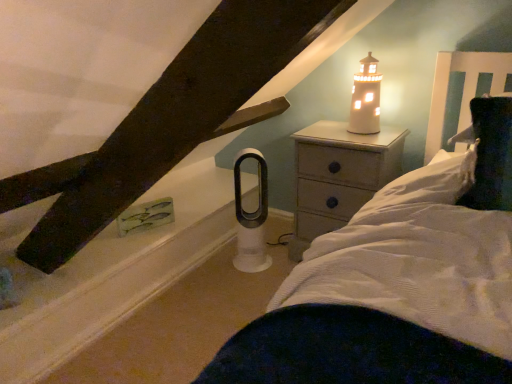
Locate an element on the screen. wooden nightstand at upper right is located at coordinates (339, 176).

Are white matte window sill at lower left and white ceramic lighthouse at upper right beside each other?

white matte window sill at lower left is not next to white ceramic lighthouse at upper right, and they're not touching.

From the image's perspective, is white matte window sill at lower left positioned above or below white ceramic lighthouse at upper right?

Clearly, from the image's perspective, white matte window sill at lower left is below white ceramic lighthouse at upper right.

Is white matte window sill at lower left facing towards white ceramic lighthouse at upper right?

No, white matte window sill at lower left is not facing towards white ceramic lighthouse at upper right.

The width and height of the screenshot is (512, 384). Find the location of `nightstand located below the white ceramic lighthouse at upper right (from the image's perspective)`. nightstand located below the white ceramic lighthouse at upper right (from the image's perspective) is located at coordinates (339, 176).

Is white ceramic lighthouse at upper right inside or outside of wooden nightstand at upper right?

white ceramic lighthouse at upper right lies outside wooden nightstand at upper right.

Considering the relative sizes of white ceramic lighthouse at upper right and wooden nightstand at upper right in the image provided, is white ceramic lighthouse at upper right taller than wooden nightstand at upper right?

In fact, white ceramic lighthouse at upper right may be shorter than wooden nightstand at upper right.

From the image's perspective, is white ceramic lighthouse at upper right positioned above or below wooden nightstand at upper right?

white ceramic lighthouse at upper right is above wooden nightstand at upper right.

Consider the image. From a real-world perspective, who is located higher, wooden nightstand at upper right or white ceramic lighthouse at upper right?

white ceramic lighthouse at upper right.

Is wooden nightstand at upper right turned away from white ceramic lighthouse at upper right?

wooden nightstand at upper right is not turned away from white ceramic lighthouse at upper right.

How different are the orientations of wooden nightstand at upper right and white ceramic lighthouse at upper right in degrees?

The facing directions of wooden nightstand at upper right and white ceramic lighthouse at upper right are 0.905 degrees apart.

Locate an element on the screen. candle holder above the wooden nightstand at upper right (from the image's perspective) is located at coordinates (366, 98).

Does wooden nightstand at upper right appear on the right side of white matte window sill at lower left?

Yes.

Can you confirm if wooden nightstand at upper right is smaller than white matte window sill at lower left?

Actually, wooden nightstand at upper right might be larger than white matte window sill at lower left.

Considering the sizes of wooden nightstand at upper right and white matte window sill at lower left in the image, is wooden nightstand at upper right wider or thinner than white matte window sill at lower left?

wooden nightstand at upper right is thinner than white matte window sill at lower left.

Is wooden nightstand at upper right turned away from white matte window sill at lower left?

No.

From a real-world perspective, is white matte window sill at lower left positioned under wooden nightstand at upper right based on gravity?

Yes, from a real-world perspective, white matte window sill at lower left is under wooden nightstand at upper right.

Looking at this image, does white matte window sill at lower left have a lesser height compared to wooden nightstand at upper right?

Indeed, white matte window sill at lower left has a lesser height compared to wooden nightstand at upper right.

Are white matte window sill at lower left and wooden nightstand at upper right making contact?

No, white matte window sill at lower left is not touching wooden nightstand at upper right.

Which is more to the right, white ceramic lighthouse at upper right or white matte window sill at lower left?

white ceramic lighthouse at upper right.

Which is in front, white ceramic lighthouse at upper right or white matte window sill at lower left?

white matte window sill at lower left is closer to the camera.

Is white ceramic lighthouse at upper right wider than white matte window sill at lower left?

No, white ceramic lighthouse at upper right is not wider than white matte window sill at lower left.

At what (x,y) coordinates should I click in order to perform the action: click on window sill in front of the white ceramic lighthouse at upper right. Please return your answer as a coordinate pair (x, y). The height and width of the screenshot is (384, 512). Looking at the image, I should click on (114, 276).

I want to click on window sill that appears below the white ceramic lighthouse at upper right (from the image's perspective), so click(x=114, y=276).

Image resolution: width=512 pixels, height=384 pixels. I want to click on nightstand that is under the white ceramic lighthouse at upper right (from a real-world perspective), so click(339, 176).

Estimate the real-world distances between objects in this image. Which object is further from wooden nightstand at upper right, white ceramic lighthouse at upper right or white matte window sill at lower left?

white matte window sill at lower left is further to wooden nightstand at upper right.

Looking at the image, which one is located closer to white ceramic lighthouse at upper right, white matte window sill at lower left or wooden nightstand at upper right?

wooden nightstand at upper right is closer to white ceramic lighthouse at upper right.

From the image, which object appears to be nearer to wooden nightstand at upper right, white matte window sill at lower left or white ceramic lighthouse at upper right?

The object closer to wooden nightstand at upper right is white ceramic lighthouse at upper right.

Considering their positions, is wooden nightstand at upper right positioned closer to white ceramic lighthouse at upper right than white matte window sill at lower left?

Based on the image, wooden nightstand at upper right appears to be nearer to white ceramic lighthouse at upper right.

Estimate the real-world distances between objects in this image. Which object is further from white matte window sill at lower left, wooden nightstand at upper right or white ceramic lighthouse at upper right?

Among the two, white ceramic lighthouse at upper right is located further to white matte window sill at lower left.

Consider the image. Which object lies further to the anchor point white matte window sill at lower left, white ceramic lighthouse at upper right or wooden nightstand at upper right?

Based on the image, white ceramic lighthouse at upper right appears to be further to white matte window sill at lower left.

In order to click on nightstand that lies between white ceramic lighthouse at upper right and white matte window sill at lower left from top to bottom in this screenshot , I will do `click(339, 176)`.